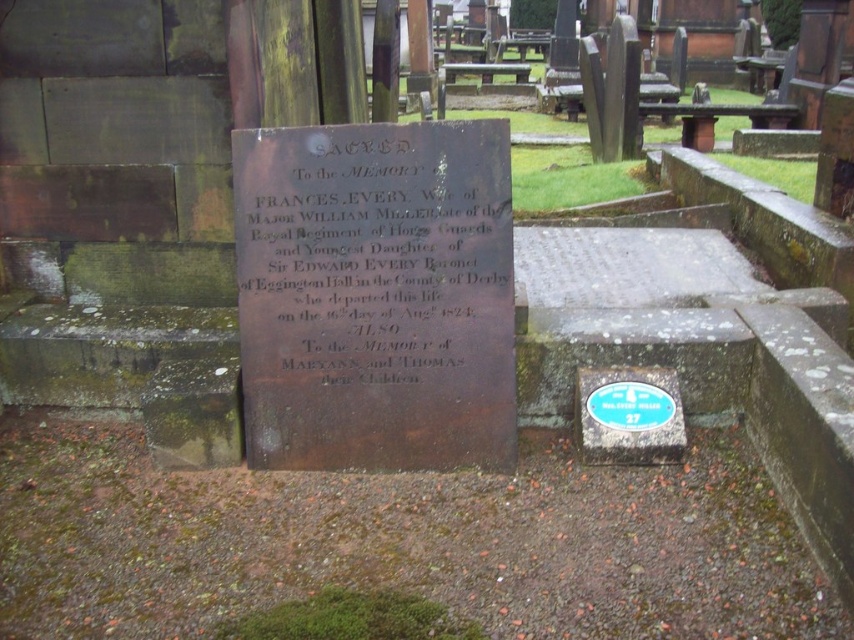
Question: Which point appears farthest from the camera in this image?

Choices:
 (A) (416, 337)
 (B) (600, 406)

Answer: (B)

Question: Is bronze plaque at center smaller than green painted metal sign at lower right?

Choices:
 (A) no
 (B) yes

Answer: (A)

Question: Among these objects, which one is farthest from the camera?

Choices:
 (A) green painted metal sign at lower right
 (B) bronze plaque at center

Answer: (A)

Question: Does bronze plaque at center have a larger size compared to green painted metal sign at lower right?

Choices:
 (A) yes
 (B) no

Answer: (A)

Question: Which point appears closest to the camera in this image?

Choices:
 (A) (575, 420)
 (B) (252, 451)

Answer: (B)

Question: Is bronze plaque at center closer to camera compared to green painted metal sign at lower right?

Choices:
 (A) no
 (B) yes

Answer: (B)